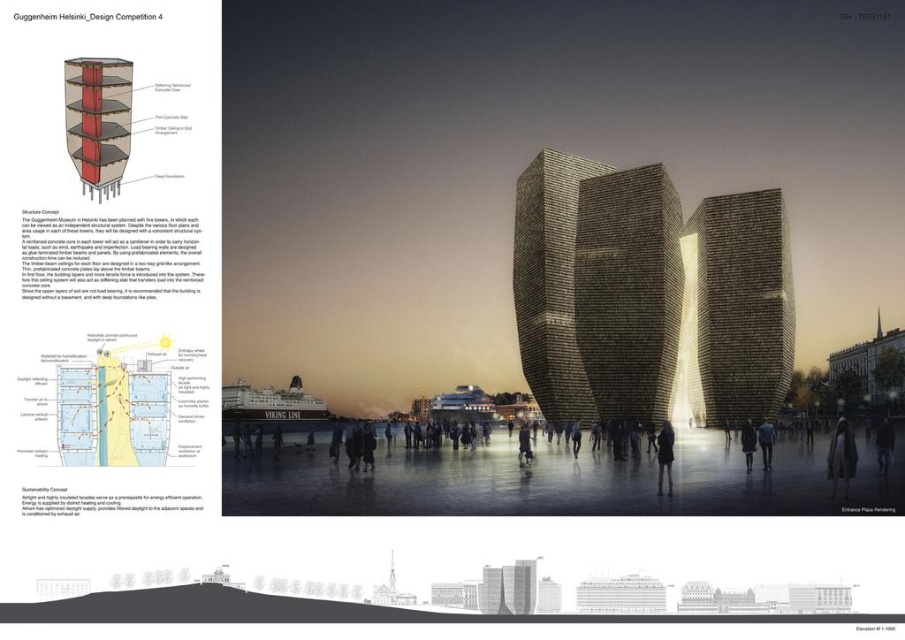
You are standing at the entrance of the plaza and want to reach the dark gray stone tower at center. Based on the coordinates provided, in which direction should you move relative to your current position?

The dark gray stone tower at center is located at coordinates (627, 291), so you should move towards the center of the plaza to reach it.

You are an architect reviewing the Guggenheim Helsinki Design Competition 4. You notice the rustic stone tower at center and the dark gray fabric coat at center in the plaza. From your viewpoint, which object is closer to you?

The rustic stone tower at center is closer to you because the dark gray fabric coat at center is behind it.